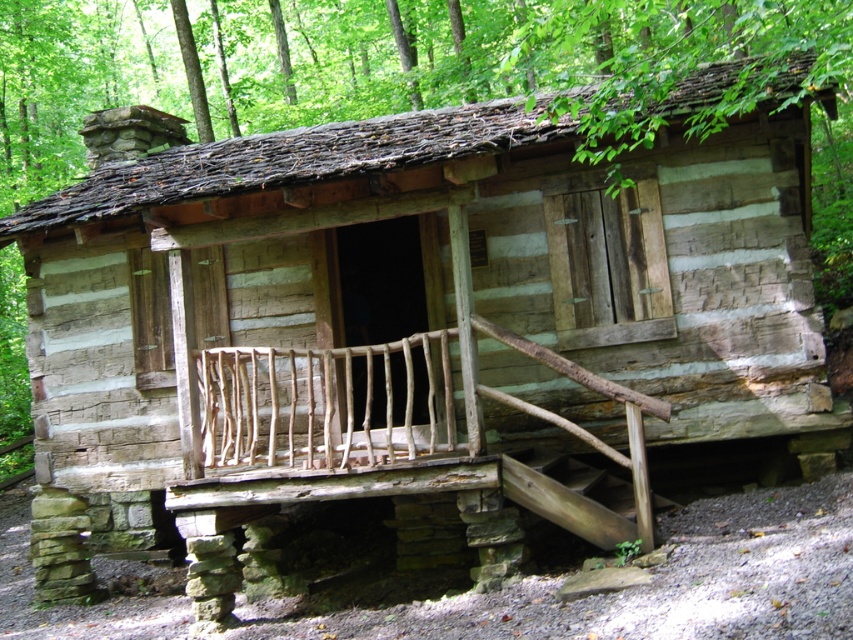
You are a delivery person with a package that requires a 1.5 meter clear path to carry it safely. You need to move from the wooden stairs at lower center to the rustic wooden porch at center. Is there enough space between them for your delivery?

The rustic wooden porch at center and wooden stairs at lower center are 1.02 meters apart, which is less than the required 1.5 meters. Therefore, there isn not enough space for the delivery.

You are standing at the entrance of the rustic log cabin and want to reach the rustic wooden porch at center. Which direction should you move relative to your current position?

The rustic wooden porch at center is located at point (383, 433), so you should move forward towards it from the entrance.

You are a delivery person carrying a large package that is 2 meters wide. You need to deliver it to the rustic wooden porch at center. Can you fit the package on the porch if the wooden stairs at lower center are in the way?

The rustic wooden porch at center has a larger width than the wooden stairs at lower center, so the package might still fit depending on the exact dimensions of the porch. However, since the stairs are at the lower center, they may block part of the porch. Without knowing the exact width of the porch, it is hard to say for sure, but the porch is wider than the stairs, so there might be enough space around the stairs to place the package.